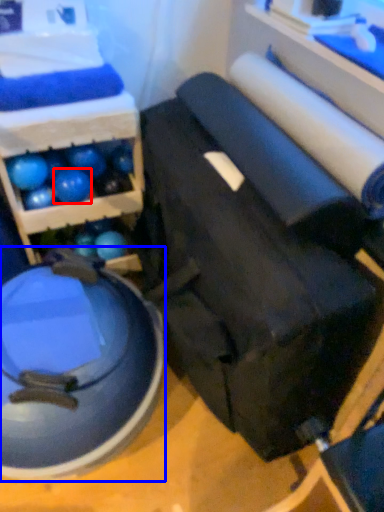
Question: Which object appears closest to the camera in this image, ball (highlighted by a red box) or swivel chair (highlighted by a blue box)?

Choices:
 (A) ball
 (B) swivel chair

Answer: (B)